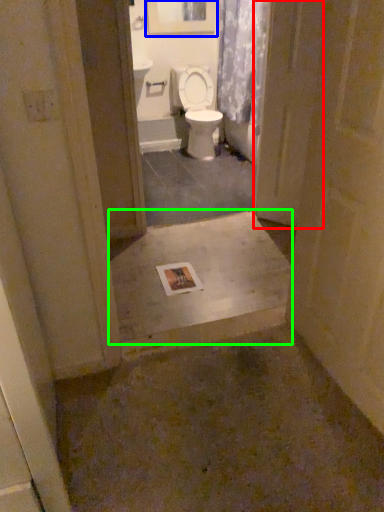
Question: Which object is positioned closest to screen door (highlighted by a red box)? Select from picture frame (highlighted by a blue box) and concrete (highlighted by a green box).

Choices:
 (A) picture frame
 (B) concrete

Answer: (B)